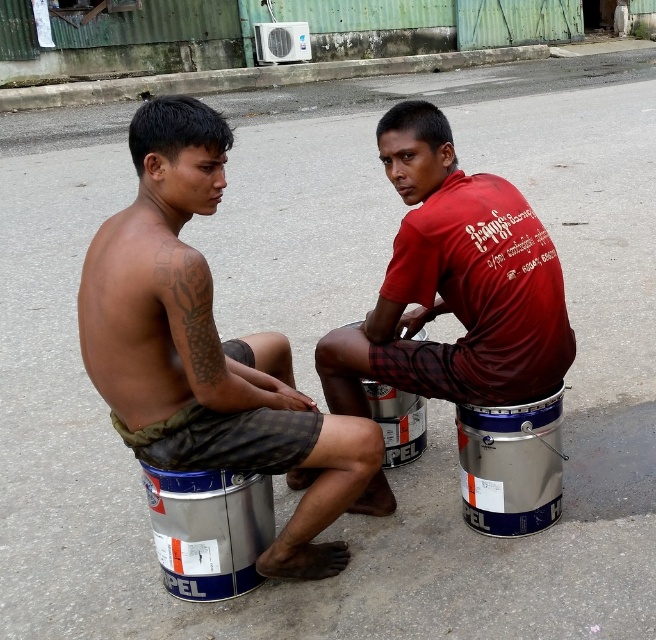
Question: Observing the image, what is the correct spatial positioning of matte black torso at left in reference to matte red shirt at center?

Choices:
 (A) left
 (B) right

Answer: (A)

Question: Among these points, which one is nearest to the camera?

Choices:
 (A) (447, 125)
 (B) (274, 554)

Answer: (B)

Question: Where is matte black torso at left located in relation to matte red shirt at center in the image?

Choices:
 (A) above
 (B) below

Answer: (B)

Question: Which object is farther from the camera taking this photo?

Choices:
 (A) matte red shirt at center
 (B) matte black torso at left

Answer: (A)

Question: Which object is closer to the camera taking this photo?

Choices:
 (A) matte black torso at left
 (B) matte red shirt at center

Answer: (A)

Question: Is the position of matte black torso at left more distant than that of matte red shirt at center?

Choices:
 (A) no
 (B) yes

Answer: (A)